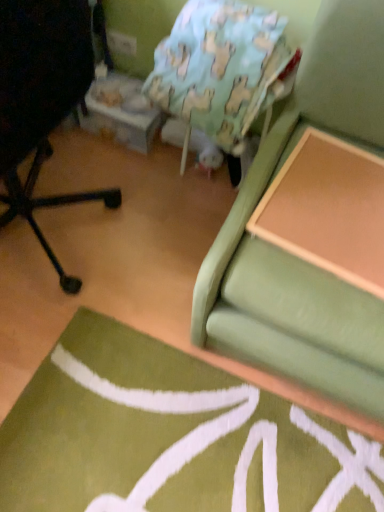
Question: Is wooden table at upper right taller or shorter than black matte chair at left?

Choices:
 (A) tall
 (B) short

Answer: (B)

Question: Is wooden table at upper right bigger or smaller than black matte chair at left?

Choices:
 (A) big
 (B) small

Answer: (B)

Question: Estimate the real-world distances between objects in this image. Which object is closer to the light blue fabric bean bag chair at upper center?

Choices:
 (A) wooden table at upper right
 (B) black matte chair at left
 (C) green fabric studio couch at upper right

Answer: (C)

Question: Which of these objects is positioned closest to the light blue fabric bean bag chair at upper center?

Choices:
 (A) wooden table at upper right
 (B) green fabric studio couch at upper right
 (C) black matte chair at left

Answer: (B)